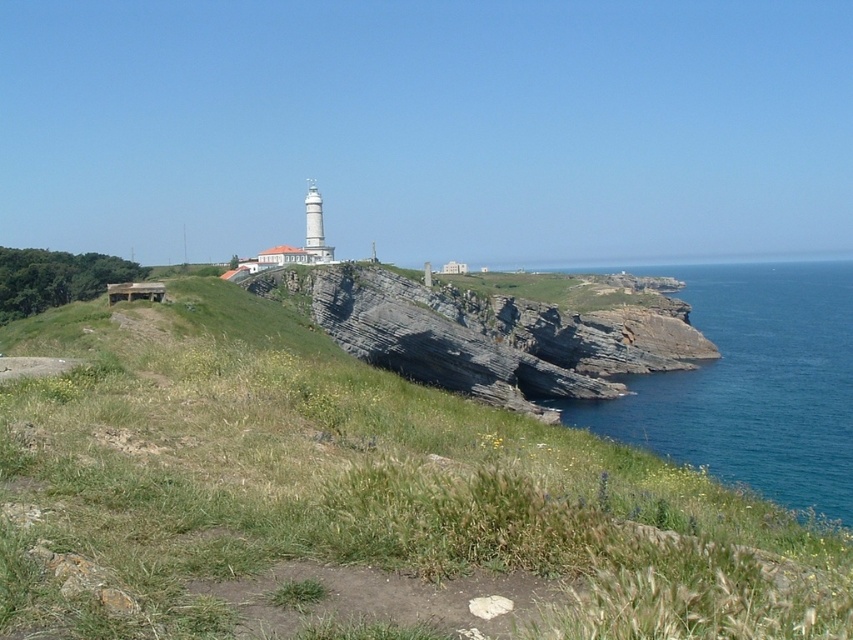
Question: Does green grassy at center lie in front of rocky cliff at center?

Choices:
 (A) yes
 (B) no

Answer: (A)

Question: Observing the image, what is the correct spatial positioning of green grassy at center in reference to blue water at right?

Choices:
 (A) below
 (B) above

Answer: (A)

Question: Can you confirm if green grassy at center is positioned above blue water at right?

Choices:
 (A) no
 (B) yes

Answer: (A)

Question: Which of the following is the farthest from the observer?

Choices:
 (A) (x=611, y=342)
 (B) (x=732, y=492)

Answer: (A)

Question: Which point appears farthest from the camera in this image?

Choices:
 (A) (120, 625)
 (B) (843, 371)
 (C) (450, 346)

Answer: (B)

Question: Which point appears closest to the camera in this image?

Choices:
 (A) (288, 504)
 (B) (628, 326)

Answer: (A)